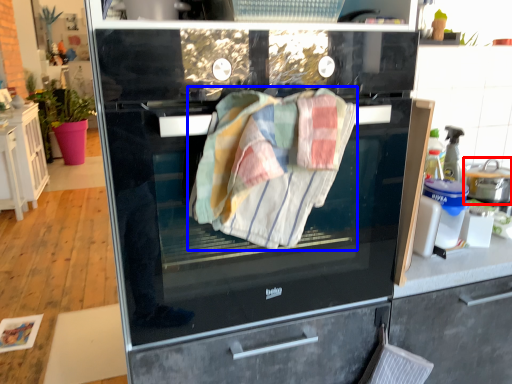
Question: Which of the following is the farthest to the observer, kitchen appliance (highlighted by a red box) or bath towel (highlighted by a blue box)?

Choices:
 (A) kitchen appliance
 (B) bath towel

Answer: (A)